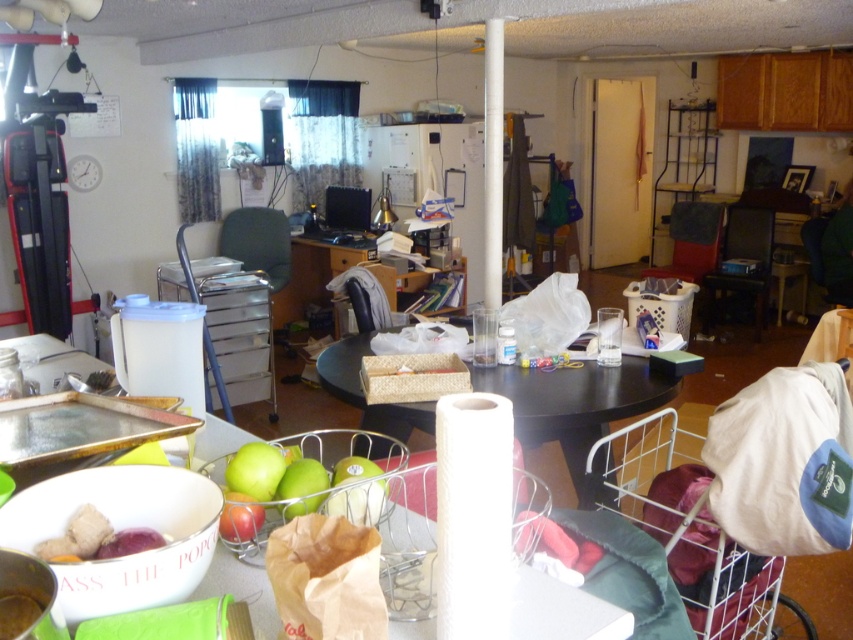
You are organizing items in a basement and need to place a smooth purple potato at lower left. The black matte table at center is available. Can the potato fit on the table?

The black matte table at center has a larger size compared to smooth purple potato at lower left, so yes, the potato can fit on the table.

You are a delivery person who just entered the room and need to place a large package on the floor. The package is 6 feet long. Is there enough space between the black matte table at center and the smooth purple potato at lower left to fit the package horizontally?

The distance between the black matte table at center and the smooth purple potato at lower left is 5.61 feet. Since the package is 6 feet long, it is slightly longer than the available space. Therefore, the package cannot fit horizontally between them.